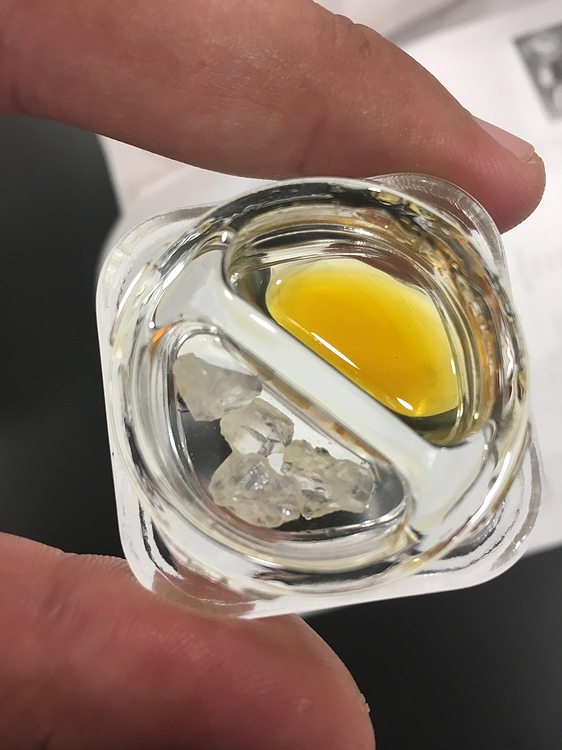
You are a GUI agent. You are given a task and a screenshot of the screen. Output one action in this format:
    pyautogui.click(x=<x>, y=<y>)
    Task: Click on the white surface
    The image size is (562, 750).
    Given the screenshot: What is the action you would take?
    pyautogui.click(x=502, y=93)